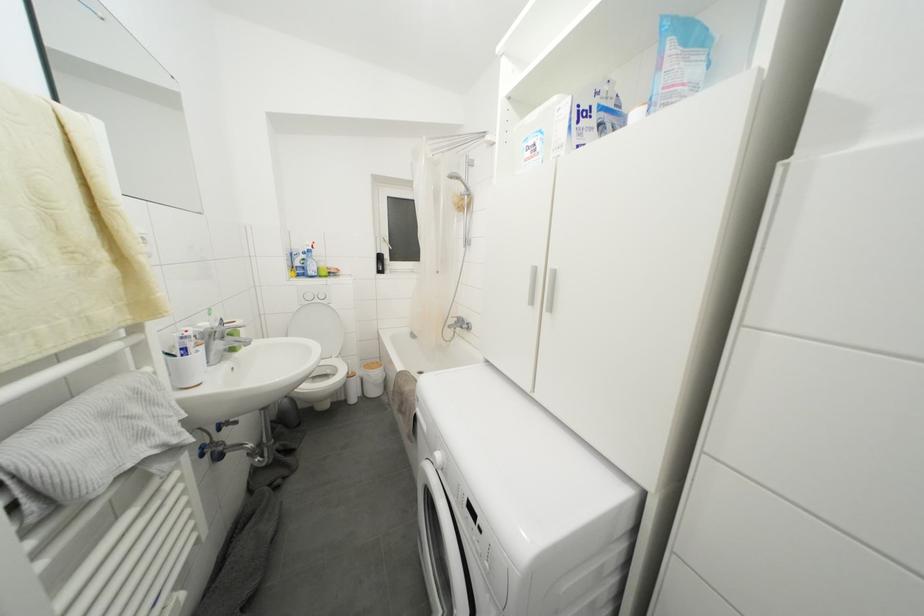
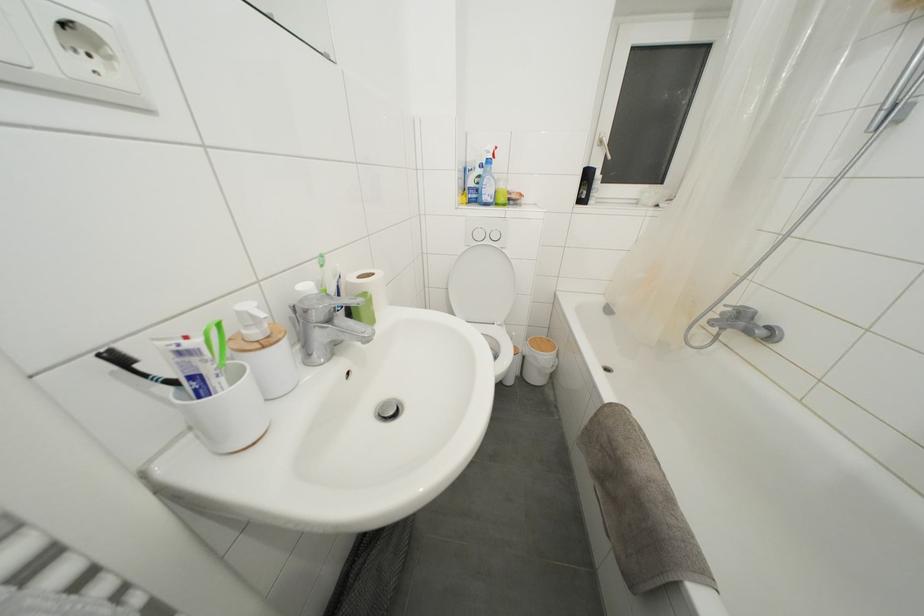
Where in the second image is the point corresponding to [187,342] from the first image?

(185, 358)